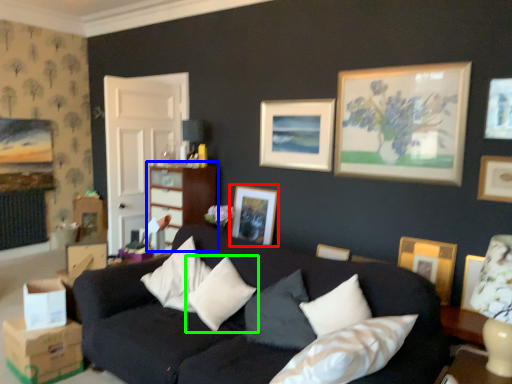
Question: Which object is the closest to the picture frame (highlighted by a red box)? Choose among these: dresser (highlighted by a blue box) or pillow (highlighted by a green box).

Choices:
 (A) dresser
 (B) pillow

Answer: (A)